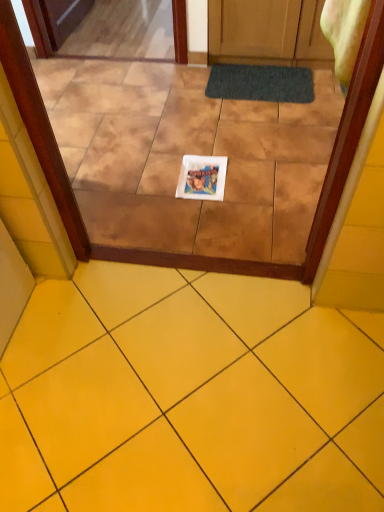
Where is `vacant area that is in front of dark gray textured bath mat at center`? The image size is (384, 512). vacant area that is in front of dark gray textured bath mat at center is located at coordinates (276, 133).